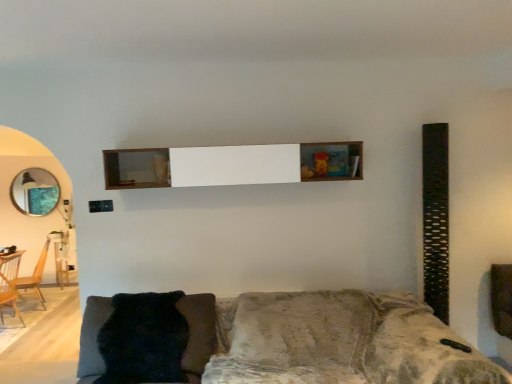
Question: In the image, is wooden shelf at center on the left side or the right side of wooden armchair at left, which ranks as the second armchair in front-to-back order?

Choices:
 (A) right
 (B) left

Answer: (A)

Question: Is point (242, 158) positioned closer to the camera than point (44, 246)?

Choices:
 (A) closer
 (B) farther

Answer: (A)

Question: Based on their relative distances, which object is nearer to the matte glass mirror at left?

Choices:
 (A) fuzzy black pillow at lower left
 (B) wooden armchair at left, which ranks as the second armchair in front-to-back order
 (C) wooden armchair at left, which is counted as the 2th armchair, starting from the back
 (D) velvet-like gray couch at lower center
 (E) wooden shelf at center

Answer: (B)

Question: Which object is the closest to the wooden armchair at left, marked as the 1th armchair in a back-to-front arrangement?

Choices:
 (A) velvet-like gray couch at lower center
 (B) wooden armchair at left, which is counted as the 2th armchair, starting from the back
 (C) matte glass mirror at left
 (D) fuzzy black pillow at lower left
 (E) wooden shelf at center

Answer: (B)